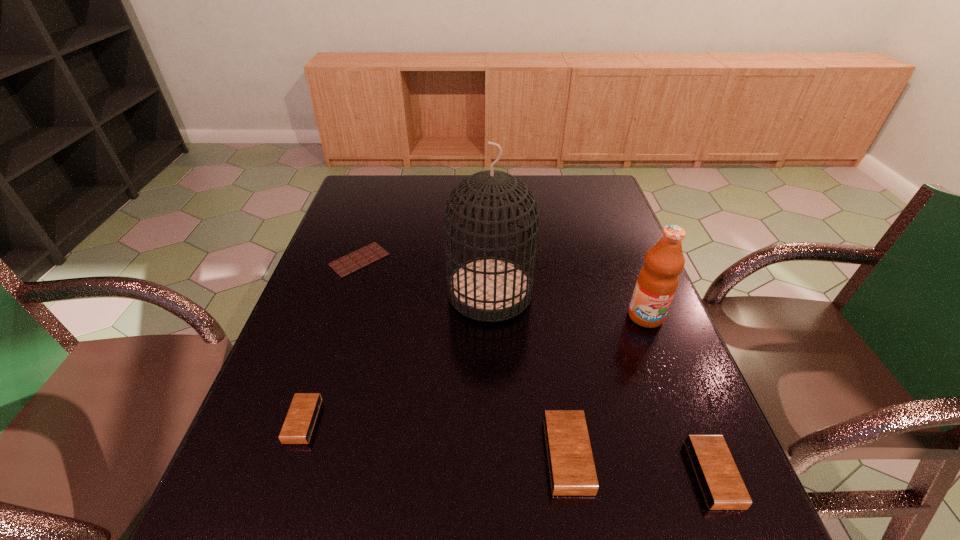
Locate an element on the screen. This screenshot has width=960, height=540. free space between the fruit juice and the fourth shortest object is located at coordinates (607, 386).

You are a GUI agent. You are given a task and a screenshot of the screen. Output one action in this format:
    pyautogui.click(x=<x>, y=<y>)
    Task: Click on the empty space that is in between the fruit juice and the second alarm clock from right to left
    This screenshot has height=540, width=960.
    Given the screenshot: What is the action you would take?
    607,386

At what (x,y) coordinates should I click in order to perform the action: click on free spot between the birdcage and the shortest object. Please return your answer as a coordinate pair (x, y). This screenshot has width=960, height=540. Looking at the image, I should click on (424, 276).

This screenshot has height=540, width=960. In order to click on vacant space that is in between the leftmost alarm clock and the birdcage in this screenshot , I will do `click(396, 356)`.

This screenshot has width=960, height=540. What are the coordinates of `object that is the third closest to the shortest alarm clock` in the screenshot? It's located at (572, 471).

The width and height of the screenshot is (960, 540). I want to click on object that is the second closest to the third tallest object, so click(489, 289).

Identify which alarm clock is located as the third nearest to the tallest object. Please provide its 2D coordinates. Your answer should be formatted as a tuple, i.e. [(x, y)], where the tuple contains the x and y coordinates of a point satisfying the conditions above.

[(722, 486)]

Locate an element on the screen. The image size is (960, 540). alarm clock that stands as the closest to the fifth shortest object is located at coordinates (722, 486).

At what (x,y) coordinates should I click in order to perform the action: click on free point that satisfies the following two spatial constraints: 1. on the front label of the second tallest object; 2. on the front face of the shortest alarm clock. Please return your answer as a coordinate pair (x, y). Looking at the image, I should click on (686, 421).

Where is `free space that satisfies the following two spatial constraints: 1. on the front label of the fruit juice; 2. on the front face of the shortest alarm clock`? free space that satisfies the following two spatial constraints: 1. on the front label of the fruit juice; 2. on the front face of the shortest alarm clock is located at coordinates (686, 421).